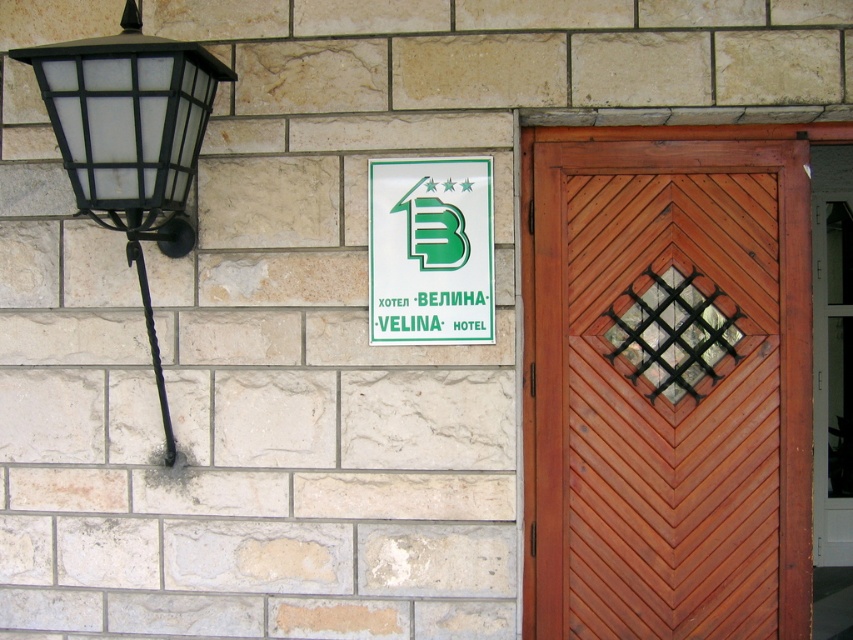
Which is above, mahogany wood door at right or matte glass wall lamp at left?

matte glass wall lamp at left is above.

Is mahogany wood door at right smaller than matte glass wall lamp at left?

Yes, mahogany wood door at right is smaller than matte glass wall lamp at left.

Which is behind, point (613, 355) or point (144, 292)?

Point (613, 355)

Find the location of a particular element. This screenshot has width=853, height=640. mahogany wood door at right is located at coordinates (666, 387).

Between matte glass wall lamp at left and white plastic sign at upper center, which one is positioned higher?

Positioned higher is matte glass wall lamp at left.

Is matte glass wall lamp at left wider than white plastic sign at upper center?

Yes.

Is point (123, 26) positioned before point (381, 280)?

That is True.

Locate an element on the screen. The image size is (853, 640). matte glass wall lamp at left is located at coordinates (131, 140).

Is mahogany wood door at right positioned before white plastic sign at upper center?

No, mahogany wood door at right is further to the viewer.

Is mahogany wood door at right taller than white plastic sign at upper center?

Correct, mahogany wood door at right is much taller as white plastic sign at upper center.

The height and width of the screenshot is (640, 853). Find the location of `mahogany wood door at right`. mahogany wood door at right is located at coordinates (666, 387).